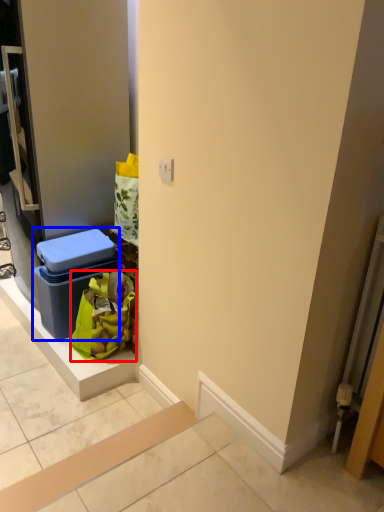
Question: Which point is closer to the camera, shopping bag (highlighted by a red box) or storage box (highlighted by a blue box)?

Choices:
 (A) shopping bag
 (B) storage box

Answer: (A)